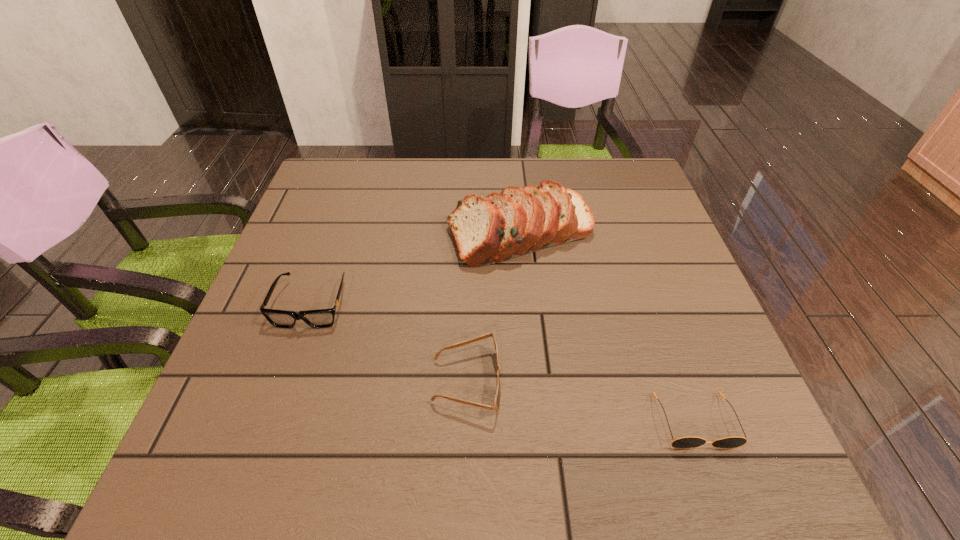
Identify the location of the farthest object. The height and width of the screenshot is (540, 960). (518, 221).

You are a GUI agent. You are given a task and a screenshot of the screen. Output one action in this format:
    pyautogui.click(x=<x>, y=<y>)
    Task: Click on the bread
    
    Given the screenshot: What is the action you would take?
    (x=518, y=221)

This screenshot has height=540, width=960. I want to click on the farthest sunglasses, so click(322, 318).

I want to click on the leftmost sunglasses, so click(x=322, y=318).

Where is `the second sunglasses from right to left`? the second sunglasses from right to left is located at coordinates (497, 402).

Locate an element on the screen. This screenshot has width=960, height=540. the shortest object is located at coordinates (685, 442).

Locate an element on the screen. This screenshot has height=540, width=960. the rightmost sunglasses is located at coordinates (685, 442).

At what (x,y) coordinates should I click in order to perform the action: click on free space located on the back of the farthest object. Please return your answer as a coordinate pair (x, y). The width and height of the screenshot is (960, 540). Looking at the image, I should click on (516, 188).

At what (x,y) coordinates should I click in order to perform the action: click on free space located 0.250m on the front-facing side of the third nearest object. Please return your answer as a coordinate pair (x, y). This screenshot has width=960, height=540. Looking at the image, I should click on (260, 453).

The height and width of the screenshot is (540, 960). In order to click on free spot located on the frames of the second sunglasses from right to left in this screenshot , I will do `click(571, 381)`.